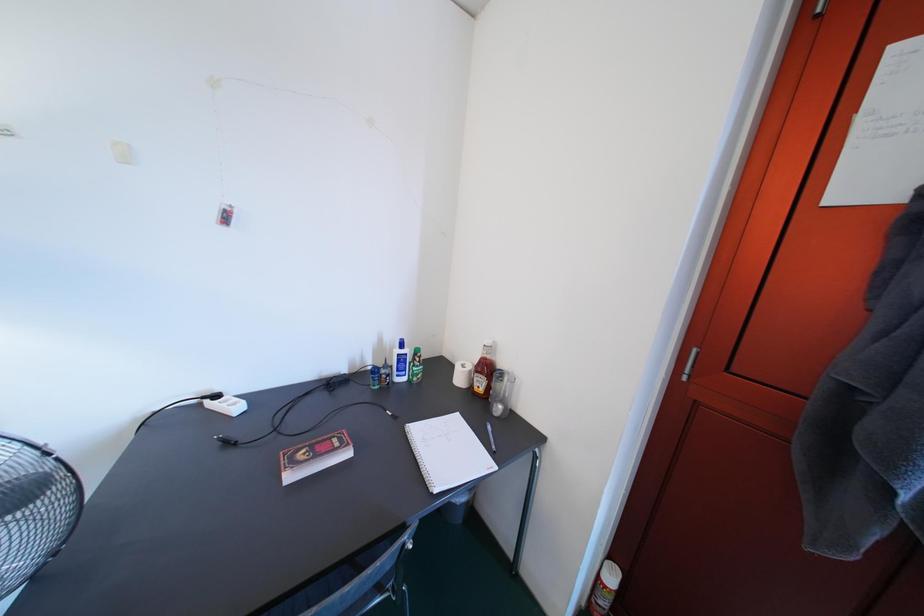
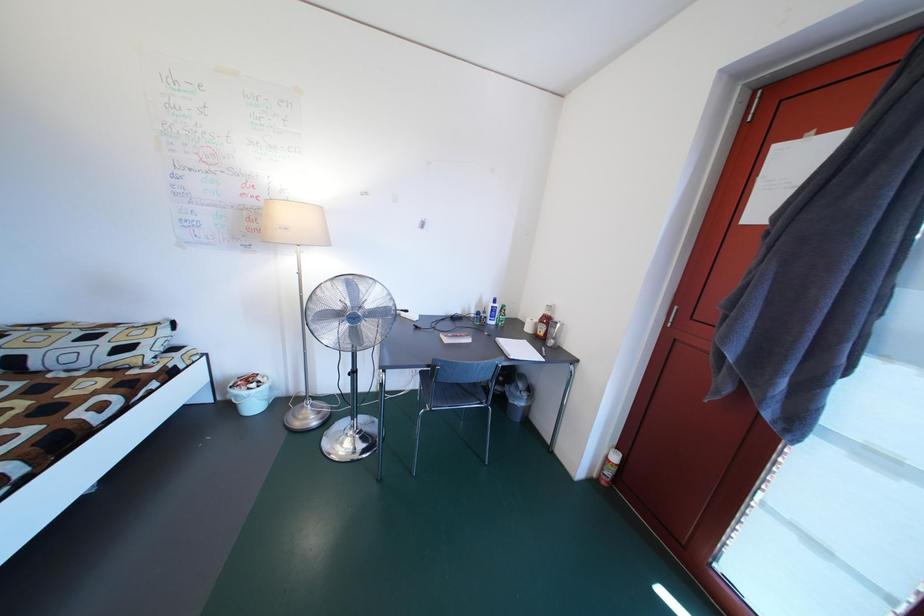
Question: The camera is either moving clockwise (left) or counter-clockwise (right) around the object. The first image is from the beginning of the video and the second image is from the end. Is the camera moving left or right when shooting the video?

Choices:
 (A) Left
 (B) Right

Answer: (B)